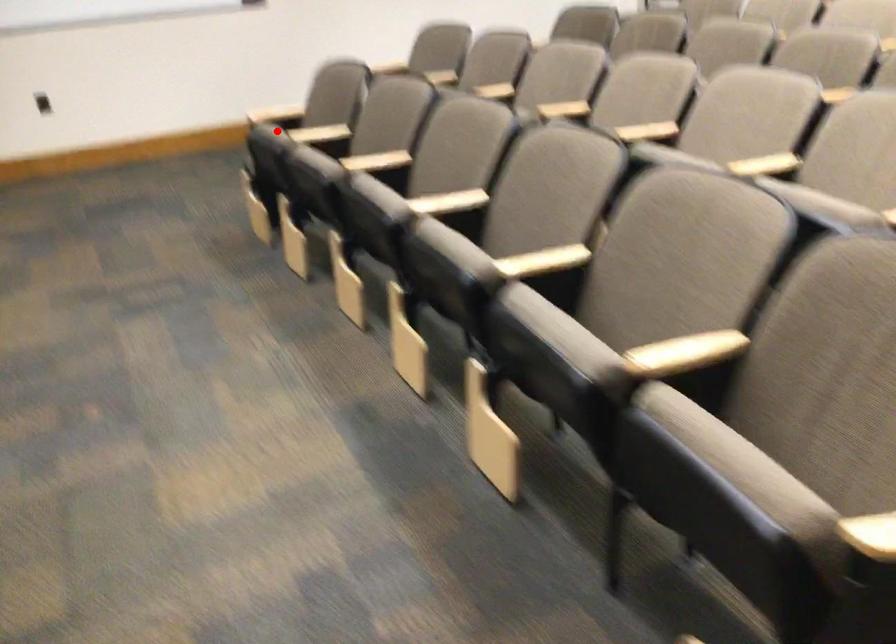
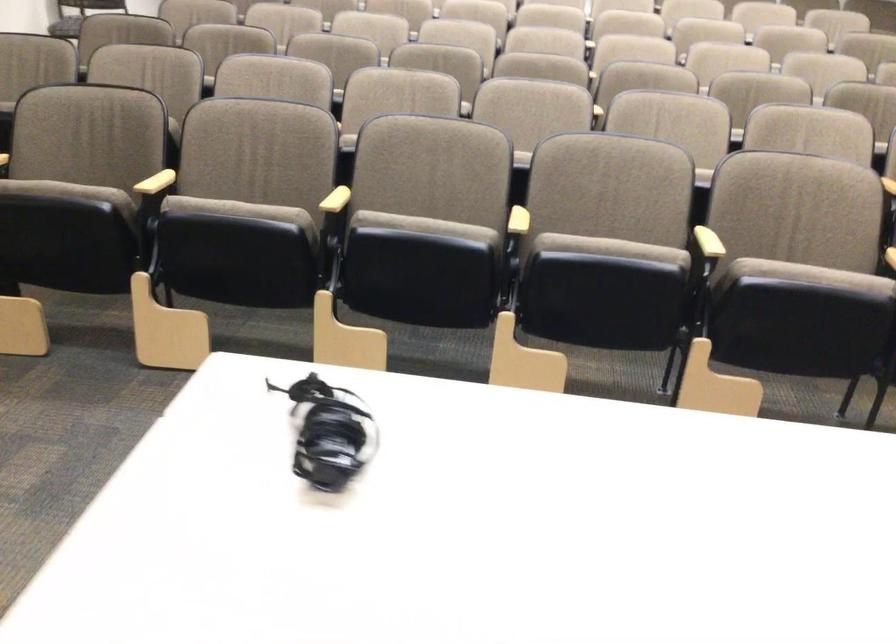
In the second image, find the point that corresponds to the highlighted location in the first image.

(156, 182)